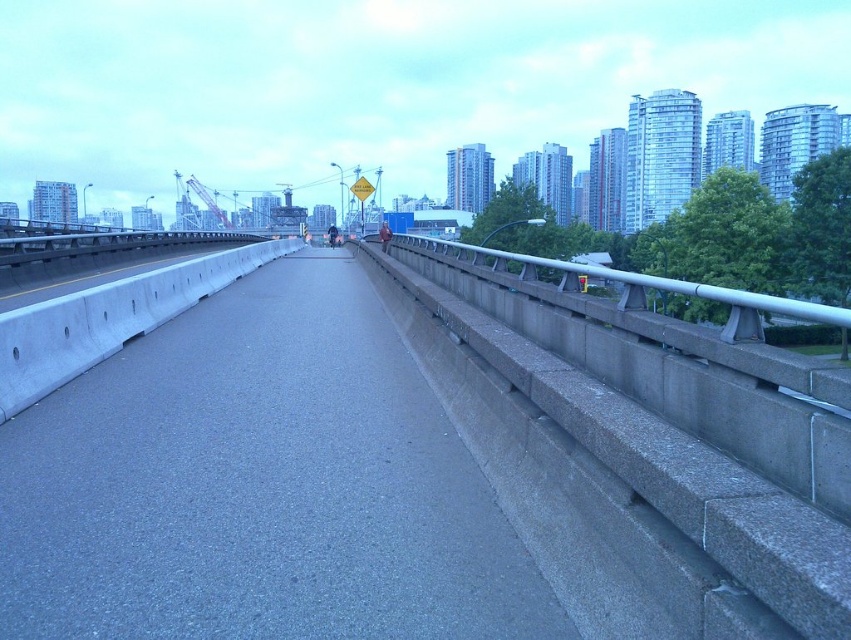
You are a drone operator trying to navigate between two points on a bridge. You see a point at coordinates (107, 394) and another at (546, 323). Which point is closer to you from your current position on the bridge?

Point (107, 394) is in front of point (546, 323), so it is closer to you.

You are a city planner analyzing the bridge layout. Given the gray concrete highway at center and the metallic gray rail at right, which one takes up more space on the bridge?

The metallic gray rail at right takes up more space than the gray concrete highway at center because the highway occupies less space according to the description.